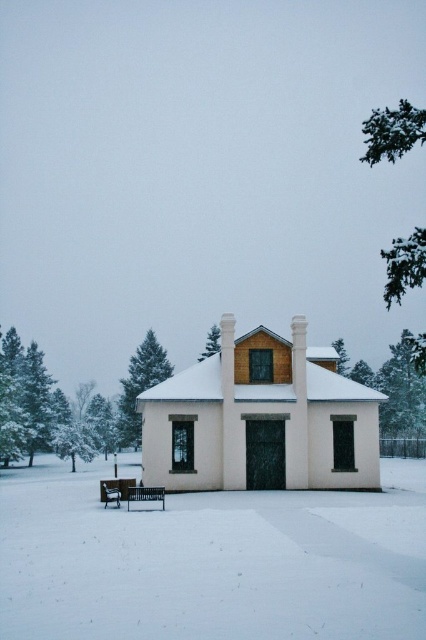
Measure the distance between green leafy tree at upper right and wooden bench at lower left.

green leafy tree at upper right and wooden bench at lower left are 146.92 feet apart from each other.

What are the coordinates of `green leafy tree at upper right` in the screenshot? It's located at (393, 132).

What do you see at coordinates (393, 132) in the screenshot? I see `green leafy tree at upper right` at bounding box center [393, 132].

Find the location of a particular element. This screenshot has width=426, height=640. green leafy tree at upper right is located at coordinates (393, 132).

Which is above, white powdery snow at center or green leafy tree at upper right?

green leafy tree at upper right is higher up.

Which is below, white powdery snow at center or green leafy tree at upper right?

Positioned lower is white powdery snow at center.

Image resolution: width=426 pixels, height=640 pixels. What do you see at coordinates (212, 561) in the screenshot?
I see `white powdery snow at center` at bounding box center [212, 561].

Identify the location of white powdery snow at center. This screenshot has width=426, height=640. (212, 561).

Can you confirm if metallic black bench at lower center is positioned below wooden bench at lower left?

Actually, metallic black bench at lower center is above wooden bench at lower left.

Can you confirm if metallic black bench at lower center is positioned to the left of wooden bench at lower left?

In fact, metallic black bench at lower center is to the right of wooden bench at lower left.

Between point (126, 493) and point (120, 493), which one is positioned in front?

Point (126, 493)

Identify the location of metallic black bench at lower center. (146, 493).